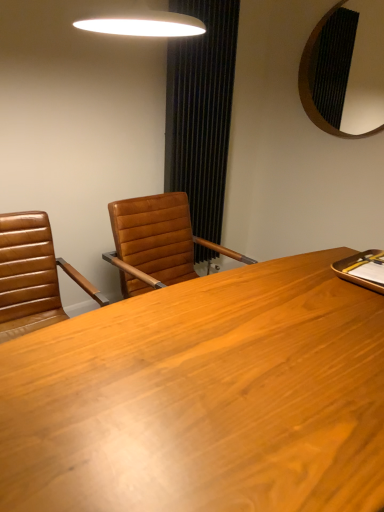
Question: Is wooden desk at center looking in the opposite direction of black textured curtain at center?

Choices:
 (A) no
 (B) yes

Answer: (A)

Question: Considering the relative sizes of wooden desk at center and black textured curtain at center in the image provided, is wooden desk at center bigger than black textured curtain at center?

Choices:
 (A) no
 (B) yes

Answer: (B)

Question: Does wooden desk at center lie in front of black textured curtain at center?

Choices:
 (A) no
 (B) yes

Answer: (B)

Question: From the image's perspective, would you say wooden desk at center is shown under black textured curtain at center?

Choices:
 (A) no
 (B) yes

Answer: (B)

Question: From a real-world perspective, is wooden desk at center located higher than black textured curtain at center?

Choices:
 (A) yes
 (B) no

Answer: (B)

Question: Is wooden desk at center smaller than black textured curtain at center?

Choices:
 (A) no
 (B) yes

Answer: (A)

Question: Are brown leather chair at left and black textured mirror at upper right far apart?

Choices:
 (A) no
 (B) yes

Answer: (B)

Question: Is brown leather chair at left further to camera compared to black textured mirror at upper right?

Choices:
 (A) yes
 (B) no

Answer: (B)

Question: Considering the relative sizes of brown leather chair at left and black textured mirror at upper right in the image provided, is brown leather chair at left taller than black textured mirror at upper right?

Choices:
 (A) no
 (B) yes

Answer: (A)

Question: Does brown leather chair at left have a smaller size compared to black textured mirror at upper right?

Choices:
 (A) yes
 (B) no

Answer: (B)

Question: Is brown leather chair at left next to black textured mirror at upper right?

Choices:
 (A) yes
 (B) no

Answer: (B)

Question: Does brown leather chair at left have a larger size compared to black textured mirror at upper right?

Choices:
 (A) no
 (B) yes

Answer: (B)

Question: Does black textured curtain at center contain wooden desk at center?

Choices:
 (A) yes
 (B) no

Answer: (B)